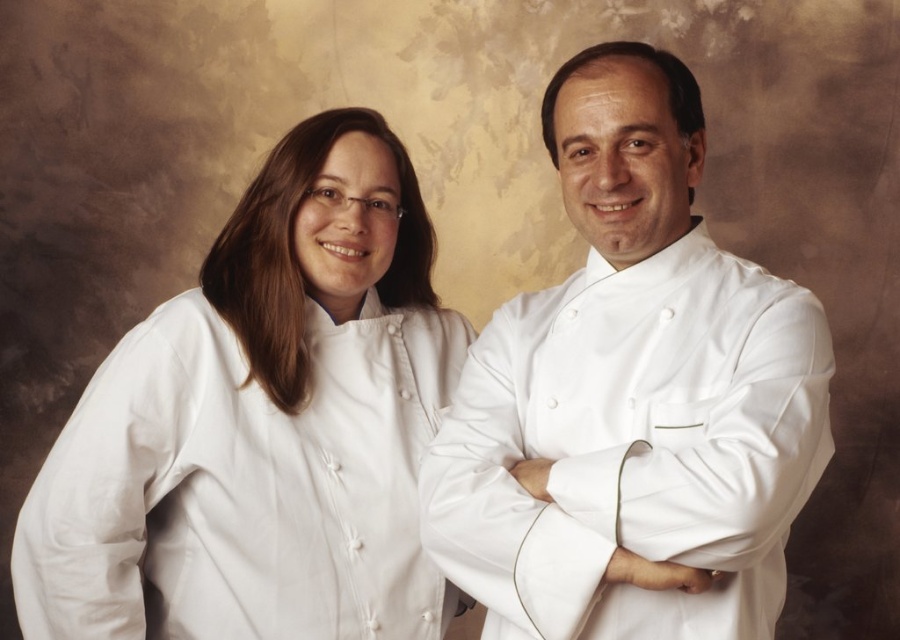
Question: Among these objects, which one is nearest to the camera?

Choices:
 (A) white smooth chef coat at center
 (B) white smooth chef coat at left

Answer: (A)

Question: Which of the following is the farthest from the observer?

Choices:
 (A) white smooth chef coat at left
 (B) white smooth chef coat at center

Answer: (A)

Question: Which point is farther to the camera?

Choices:
 (A) white satin chef coat at right
 (B) white smooth chef coat at center
 (C) white smooth chef coat at left

Answer: (C)

Question: Is white smooth chef coat at left to the left of white smooth chef coat at center from the viewer's perspective?

Choices:
 (A) no
 (B) yes

Answer: (B)

Question: Where is white smooth chef coat at center located in relation to white satin chef coat at right in the image?

Choices:
 (A) left
 (B) right

Answer: (B)

Question: Does white smooth chef coat at left appear on the right side of white satin chef coat at right?

Choices:
 (A) no
 (B) yes

Answer: (A)